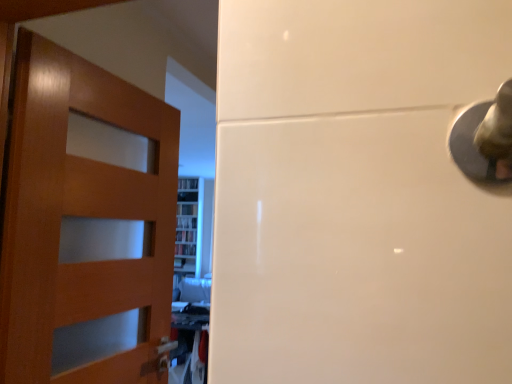
The image size is (512, 384). What do you see at coordinates (84, 226) in the screenshot?
I see `wooden door at left` at bounding box center [84, 226].

In order to click on wooden door at left in this screenshot , I will do `click(84, 226)`.

Find the location of a particular element. The image size is (512, 384). wooden door at left is located at coordinates (84, 226).